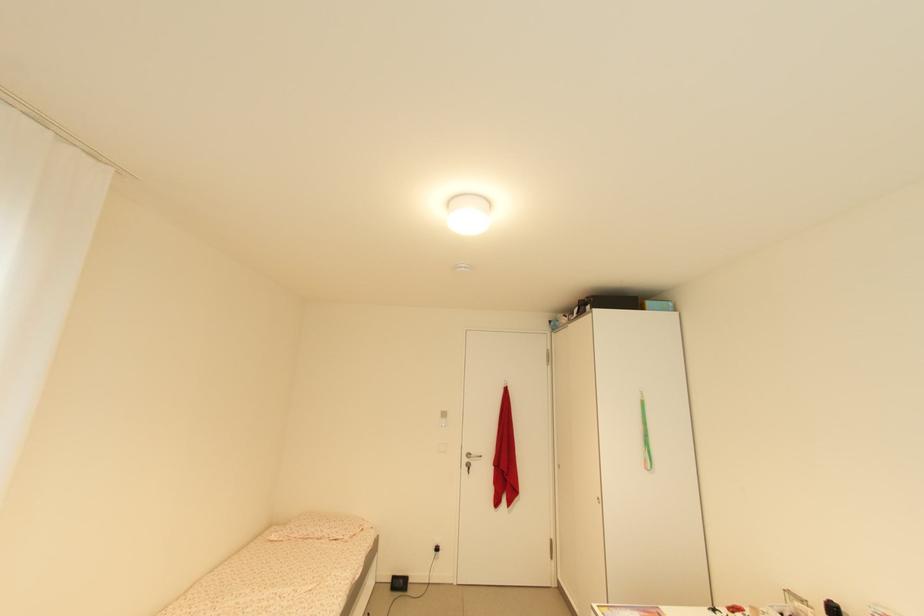
Locate an element on the screen. This screenshot has width=924, height=616. patterned pillow is located at coordinates (308, 525).